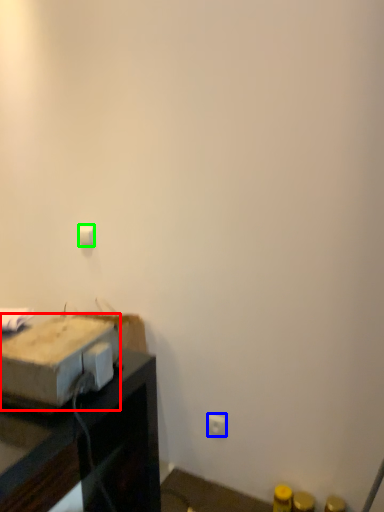
Question: Based on their relative distances, which object is nearer to cardboard box (highlighted by a red box)? Choose from electric outlet (highlighted by a blue box) and light switch (highlighted by a green box).

Choices:
 (A) electric outlet
 (B) light switch

Answer: (B)